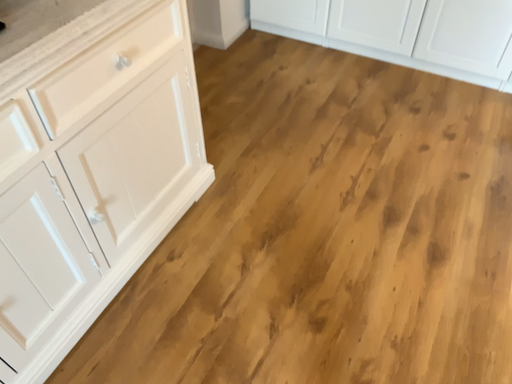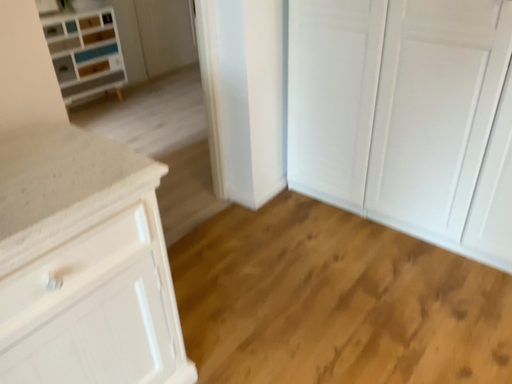
Question: Which way did the camera rotate in the video?

Choices:
 (A) rotated left
 (B) rotated right

Answer: (A)